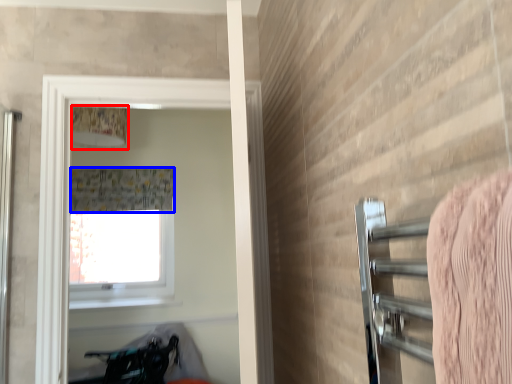
Question: Which of the following is the closest to the observer, lamp (highlighted by a red box) or shower curtain (highlighted by a blue box)?

Choices:
 (A) lamp
 (B) shower curtain

Answer: (B)